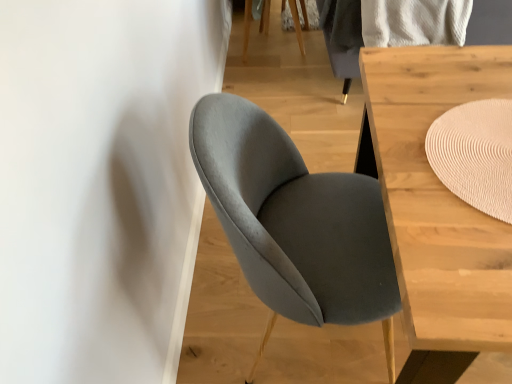
Locate an element on the screen. free space to the back side of beige woven mat at upper right is located at coordinates (438, 76).